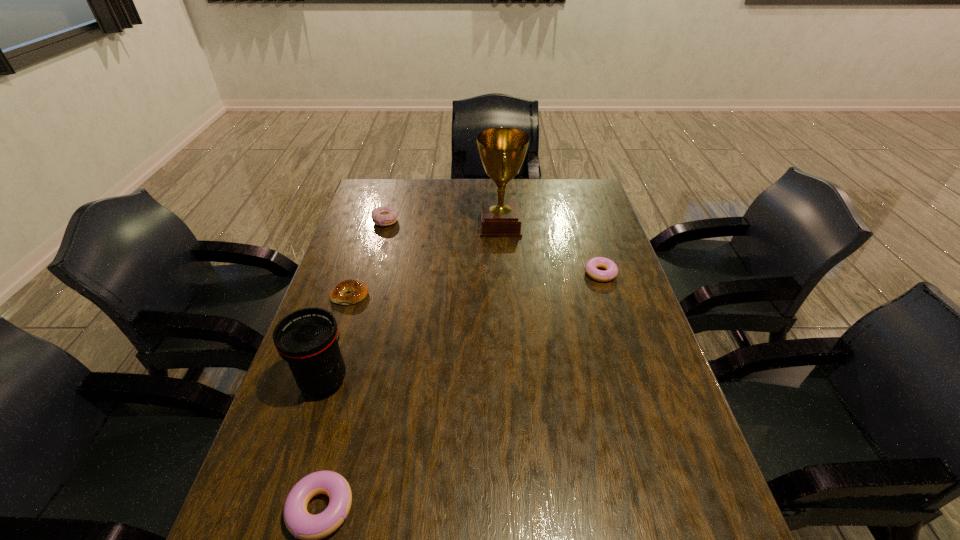
If the aim is uniform spacing by inserting an additional doughnut among them, please point to a vacant space for this new doughnut. Please provide its 2D coordinates. Your answer should be formatted as a tuple, i.e. [(x, y)], where the tuple contains the x and y coordinates of a point satisfying the conditions above.

[(493, 363)]